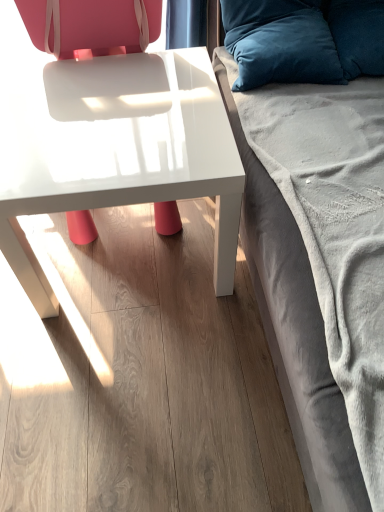
Question: Is velvety blue pillow at upper right, the first pillow positioned from the left, bigger or smaller than matte white chair at center?

Choices:
 (A) small
 (B) big

Answer: (A)

Question: From the image's perspective, is velvety blue pillow at upper right, which is the 2th pillow from right to left, above or below matte white chair at center?

Choices:
 (A) below
 (B) above

Answer: (B)

Question: Which object is positioned farthest from the velvety blue pillow at upper right, the 2th pillow when ordered from left to right?

Choices:
 (A) velvet gray studio couch at right
 (B) velvety blue pillow at upper right, the first pillow positioned from the left
 (C) white glossy table at center
 (D) matte white chair at center

Answer: (D)

Question: Which object is the closest to the velvet gray studio couch at right?

Choices:
 (A) matte white chair at center
 (B) velvety blue pillow at upper right, the first pillow positioned from the left
 (C) velvety blue pillow at upper right, the 2th pillow when ordered from left to right
 (D) white glossy table at center

Answer: (B)